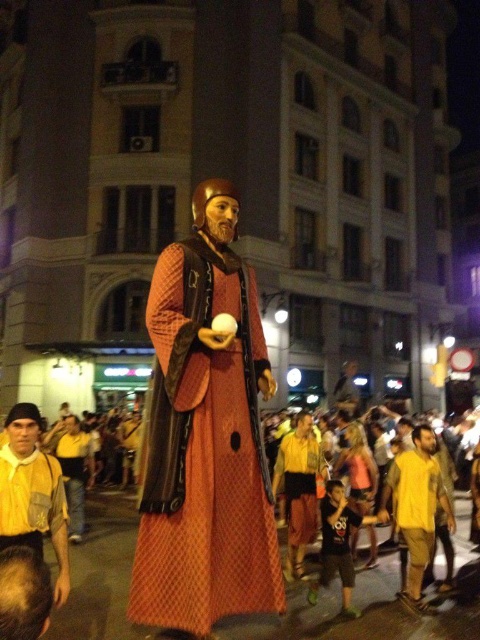
Is orange fabric figure at center positioned in front of yellow cotton shirt at center?

Yes, orange fabric figure at center is closer to the viewer.

Is point (216, 298) positioned after point (428, 554)?

No, it is in front of (428, 554).

The image size is (480, 640). Identify the location of orange fabric figure at center. (204, 436).

Identify the location of orange fabric figure at center. (204, 436).

Does yellow fabric shirt at lower left have a larger size compared to yellow cotton shirt at center?

Indeed, yellow fabric shirt at lower left has a larger size compared to yellow cotton shirt at center.

Can you confirm if yellow fabric shirt at lower left is taller than yellow cotton shirt at center?

Yes, yellow fabric shirt at lower left is taller than yellow cotton shirt at center.

What do you see at coordinates (33, 493) in the screenshot?
I see `yellow fabric shirt at lower left` at bounding box center [33, 493].

You are a GUI agent. You are given a task and a screenshot of the screen. Output one action in this format:
    pyautogui.click(x=<x>, y=<y>)
    Task: Click on the yellow fabric shirt at lower left
    
    Given the screenshot: What is the action you would take?
    pyautogui.click(x=33, y=493)

Is orange fabric figure at center to the left of yellow fabric shirt at lower left from the viewer's perspective?

Incorrect, orange fabric figure at center is not on the left side of yellow fabric shirt at lower left.

Between point (243, 317) and point (61, 483), which one is positioned in front?

Point (61, 483) is in front.

Locate an element on the screen. This screenshot has height=640, width=480. orange fabric figure at center is located at coordinates (204, 436).